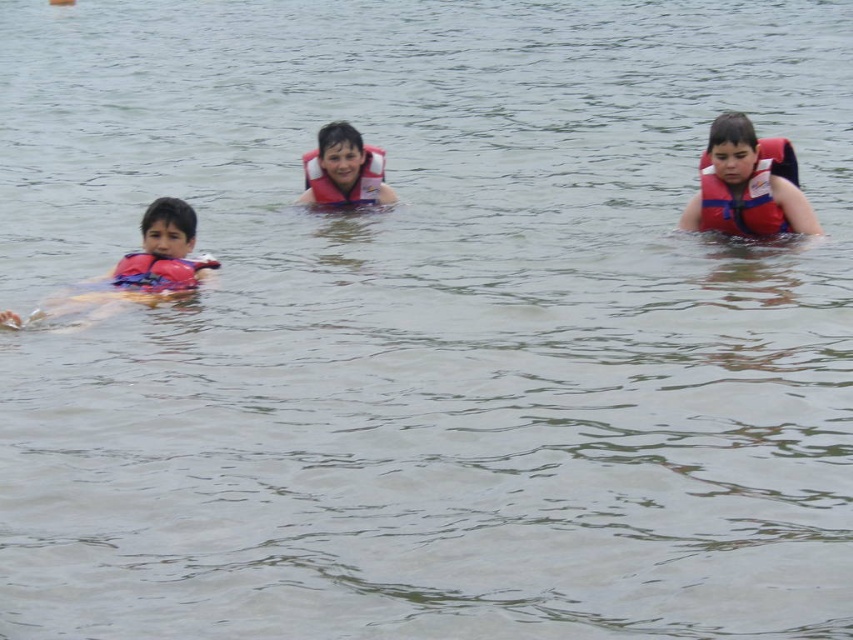
You are a lifeguard on duty and need to reach the nearest object between the pink foam float at left and the matte pink life jacket at center. Which one should you go to first?

The pink foam float at left is closer to the viewer than the matte pink life jacket at center, so you should go to the pink foam float at left first.

Looking at this image, you are a lifeguard on duty and need to determine which object is wider between the pink foam float at left and the red matte life jacket at right. Based on the scene, can you tell which one is wider?

The pink foam float at left is wider than the red matte life jacket at right according to the description.

You are a photographer trying to capture a photo of both point (161, 243) and point (347, 198) in the scene. Since you want both points to be clearly visible in your photo, which point should you focus on first to ensure the other remains in focus?

You should focus on point (347, 198) first because it is further away than point (161, 243). By focusing on the farther point, the closer point will also be within the depth of field, ensuring both are in focus.